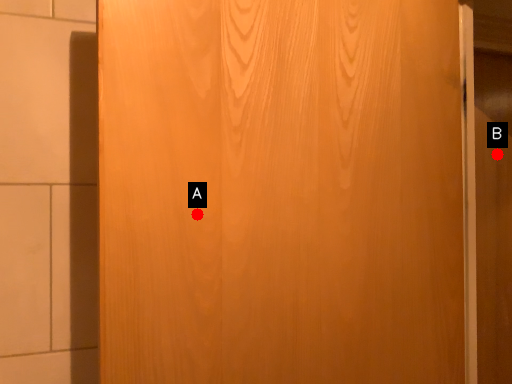
Question: Two points are circled on the image, labeled by A and B beside each circle. Which of the following is the farthest from the observer?

Choices:
 (A) A is further
 (B) B is further

Answer: (B)